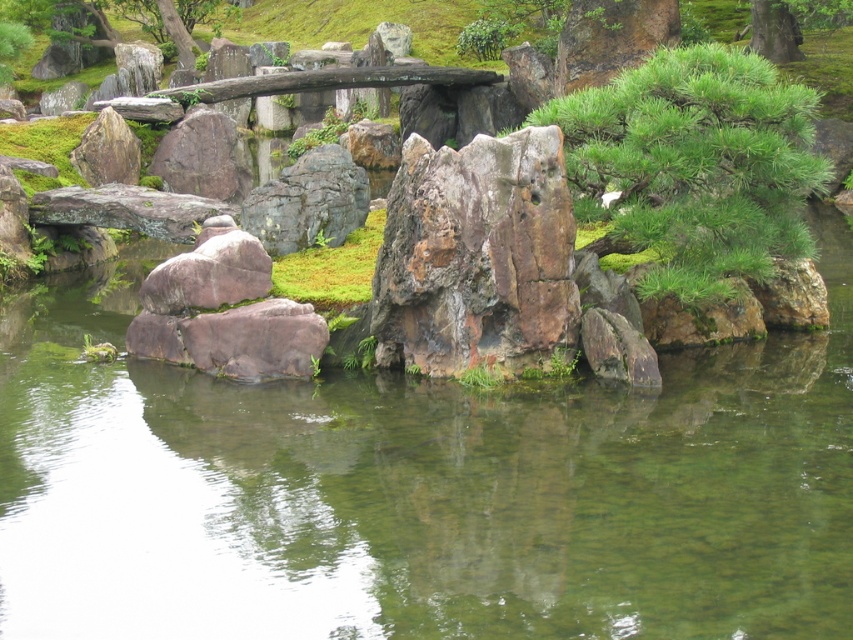
Can you confirm if clear water at center is wider than rusty rock at center?

Yes, clear water at center is wider than rusty rock at center.

Between clear water at center and rusty rock at center, which one is positioned higher?

rusty rock at center is above.

Describe the element at coordinates (421, 490) in the screenshot. I see `clear water at center` at that location.

At what (x,y) coordinates should I click in order to perform the action: click on clear water at center. Please return your answer as a coordinate pair (x, y). Looking at the image, I should click on (421, 490).

Is clear water at center bigger than rusty metallic rock at center?

Yes, clear water at center is bigger than rusty metallic rock at center.

Is clear water at center wider than rusty metallic rock at center?

Correct, the width of clear water at center exceeds that of rusty metallic rock at center.

You are a GUI agent. You are given a task and a screenshot of the screen. Output one action in this format:
    pyautogui.click(x=<x>, y=<y>)
    Task: Click on the clear water at center
    Image resolution: width=853 pixels, height=640 pixels.
    Given the screenshot: What is the action you would take?
    pyautogui.click(x=421, y=490)

Measure the distance between point (693, 188) and camera.

13.83 meters

Does green textured pine tree at center right have a smaller size compared to rusty rock at center?

Correct, green textured pine tree at center right occupies less space than rusty rock at center.

The image size is (853, 640). What do you see at coordinates (694, 164) in the screenshot?
I see `green textured pine tree at center right` at bounding box center [694, 164].

Identify the location of green textured pine tree at center right. This screenshot has width=853, height=640. (694, 164).